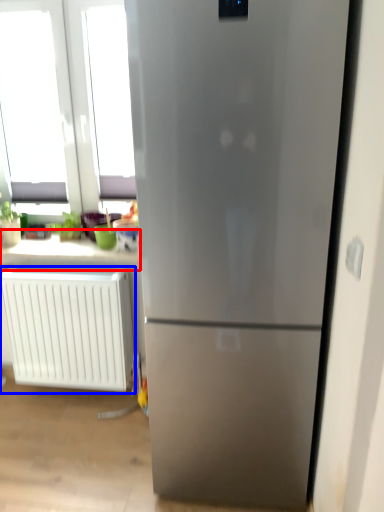
Question: Among these objects, which one is nearest to the camera, counter top (highlighted by a red box) or radiator (highlighted by a blue box)?

Choices:
 (A) counter top
 (B) radiator

Answer: (B)